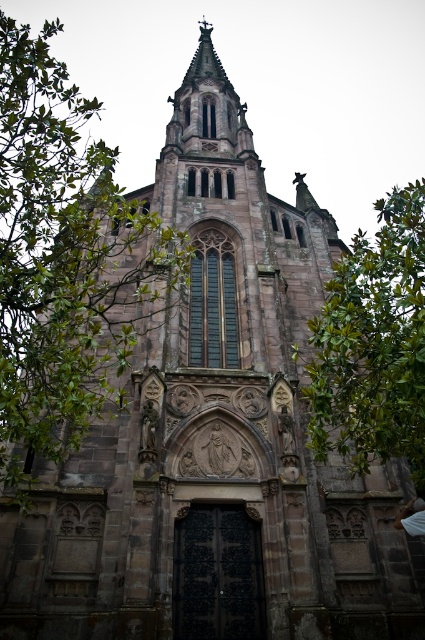
Based on the scene description, where is the green leafy tree at left located in the image?

The green leafy tree at left is located at point (x=65, y=260) in the image.

Based on the coordinates provided, which object is located at point (65, 260)?

The green leafy tree at left is located at point (65, 260).